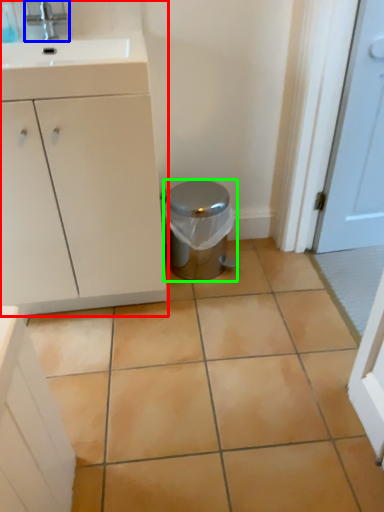
Question: Based on their relative distances, which object is nearer to bathroom cabinet (highlighted by a red box)? Choose from tap (highlighted by a blue box) and potty (highlighted by a green box).

Choices:
 (A) tap
 (B) potty

Answer: (B)